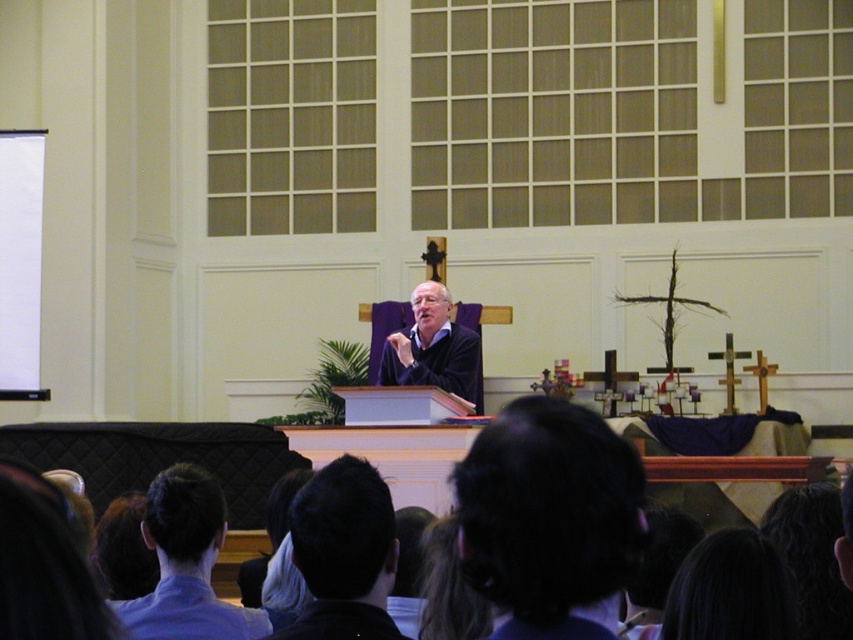
Is point (367, 561) closer to viewer compared to point (189, 500)?

Yes, point (367, 561) is closer to viewer.

Locate an element on the screen. This screenshot has height=640, width=853. dark brown hair at center is located at coordinates (343, 554).

From the picture: Does dark brown hair at center appear on the left side of dark blue fabric at center?

Indeed, dark brown hair at center is positioned on the left side of dark blue fabric at center.

Who is taller, dark brown hair at center or dark blue fabric at center?

dark blue fabric at center

You are a GUI agent. You are given a task and a screenshot of the screen. Output one action in this format:
    pyautogui.click(x=<x>, y=<y>)
    Task: Click on the dark brown hair at center
    The image size is (853, 640).
    Given the screenshot: What is the action you would take?
    pyautogui.click(x=343, y=554)

Locate an element on the screen. The image size is (853, 640). dark brown hair at center is located at coordinates click(343, 554).

Is dark brown hair at lower center to the right of dark hair at lower center from the viewer's perspective?

Incorrect, dark brown hair at lower center is not on the right side of dark hair at lower center.

Is point (506, 540) in front of point (718, 532)?

Yes, it is in front of point (718, 532).

What are the coordinates of `dark brown hair at lower center` in the screenshot? It's located at (549, 518).